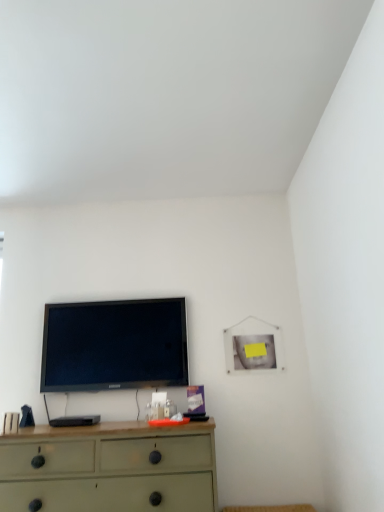
Question: Is matte green dresser at lower center not near black glossy tv at upper center?

Choices:
 (A) no
 (B) yes

Answer: (A)

Question: Considering the relative sizes of matte green dresser at lower center and black glossy tv at upper center in the image provided, is matte green dresser at lower center bigger than black glossy tv at upper center?

Choices:
 (A) yes
 (B) no

Answer: (A)

Question: Considering the relative positions of matte green dresser at lower center and black glossy tv at upper center in the image provided, is matte green dresser at lower center to the right of black glossy tv at upper center from the viewer's perspective?

Choices:
 (A) no
 (B) yes

Answer: (B)

Question: Is matte green dresser at lower center in contact with black glossy tv at upper center?

Choices:
 (A) yes
 (B) no

Answer: (B)

Question: Considering the relative sizes of matte green dresser at lower center and black glossy tv at upper center in the image provided, is matte green dresser at lower center shorter than black glossy tv at upper center?

Choices:
 (A) yes
 (B) no

Answer: (A)

Question: Can you confirm if matte green dresser at lower center is smaller than black glossy tv at upper center?

Choices:
 (A) no
 (B) yes

Answer: (A)

Question: Is the depth of black glossy tv at upper center less than that of matte green dresser at lower center?

Choices:
 (A) no
 (B) yes

Answer: (A)

Question: Can you confirm if black glossy tv at upper center is shorter than matte green dresser at lower center?

Choices:
 (A) yes
 (B) no

Answer: (B)

Question: From a real-world perspective, is black glossy tv at upper center beneath matte green dresser at lower center?

Choices:
 (A) yes
 (B) no

Answer: (B)

Question: Is black glossy tv at upper center thinner than matte green dresser at lower center?

Choices:
 (A) no
 (B) yes

Answer: (B)

Question: From the image's perspective, is black glossy tv at upper center above matte green dresser at lower center?

Choices:
 (A) no
 (B) yes

Answer: (B)

Question: Is the surface of black glossy tv at upper center in direct contact with matte green dresser at lower center?

Choices:
 (A) yes
 (B) no

Answer: (B)

Question: Do you think black glossy tv at upper center is within matte green dresser at lower center, or outside of it?

Choices:
 (A) outside
 (B) inside

Answer: (A)